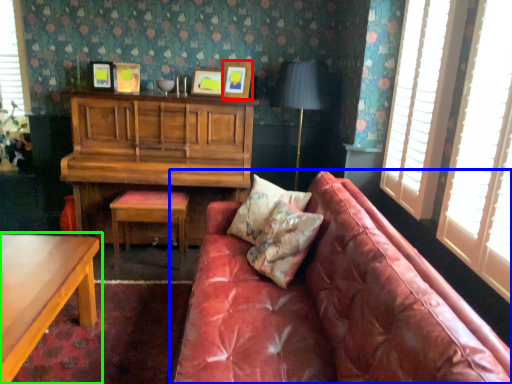
Question: Which object is the farthest from picture frame (highlighted by a red box)? Choose among these: studio couch (highlighted by a blue box) or table (highlighted by a green box).

Choices:
 (A) studio couch
 (B) table

Answer: (B)